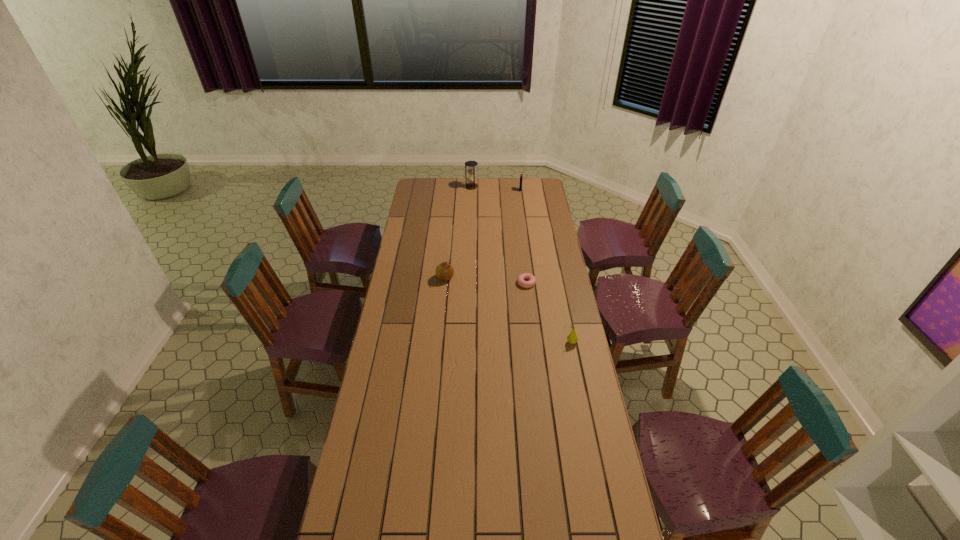
The width and height of the screenshot is (960, 540). In order to click on hourglass in this screenshot , I will do `click(471, 184)`.

Identify the location of the tallest object. Image resolution: width=960 pixels, height=540 pixels. (471, 184).

This screenshot has width=960, height=540. Find the location of `igniter`. igniter is located at coordinates pos(521,174).

This screenshot has width=960, height=540. Find the location of `the taller pear`. the taller pear is located at coordinates (444, 271).

Identify the location of the farther pear. The image size is (960, 540). (444, 271).

What are the coordinates of `the nearest object` in the screenshot? It's located at (572, 338).

Image resolution: width=960 pixels, height=540 pixels. In order to click on the right pear in this screenshot , I will do `click(572, 338)`.

Where is `doughnut`? doughnut is located at coordinates (521, 278).

Find the location of a particular element. vacant region located 0.280m on the front of the second object from left to right is located at coordinates (470, 214).

Where is `vacant space located on the right of the igniter`? The image size is (960, 540). vacant space located on the right of the igniter is located at coordinates (530, 190).